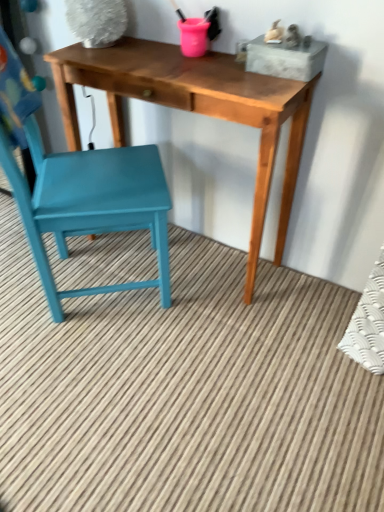
Question: From the image's perspective, is wooden table at center above or below teal painted wood chair at left?

Choices:
 (A) above
 (B) below

Answer: (A)

Question: From a real-world perspective, is wooden table at center positioned above or below teal painted wood chair at left?

Choices:
 (A) below
 (B) above

Answer: (A)

Question: Considering the positions of point (135, 45) and point (24, 220), is point (135, 45) closer or farther from the camera than point (24, 220)?

Choices:
 (A) closer
 (B) farther

Answer: (B)

Question: From a real-world perspective, is teal painted wood chair at left physically located above or below wooden table at center?

Choices:
 (A) below
 (B) above

Answer: (B)

Question: In the image, is teal painted wood chair at left positioned in front of or behind wooden table at center?

Choices:
 (A) front
 (B) behind

Answer: (A)

Question: Is teal painted wood chair at left situated inside wooden table at center or outside?

Choices:
 (A) inside
 (B) outside

Answer: (B)

Question: Looking at the image, does teal painted wood chair at left seem bigger or smaller compared to wooden table at center?

Choices:
 (A) big
 (B) small

Answer: (A)